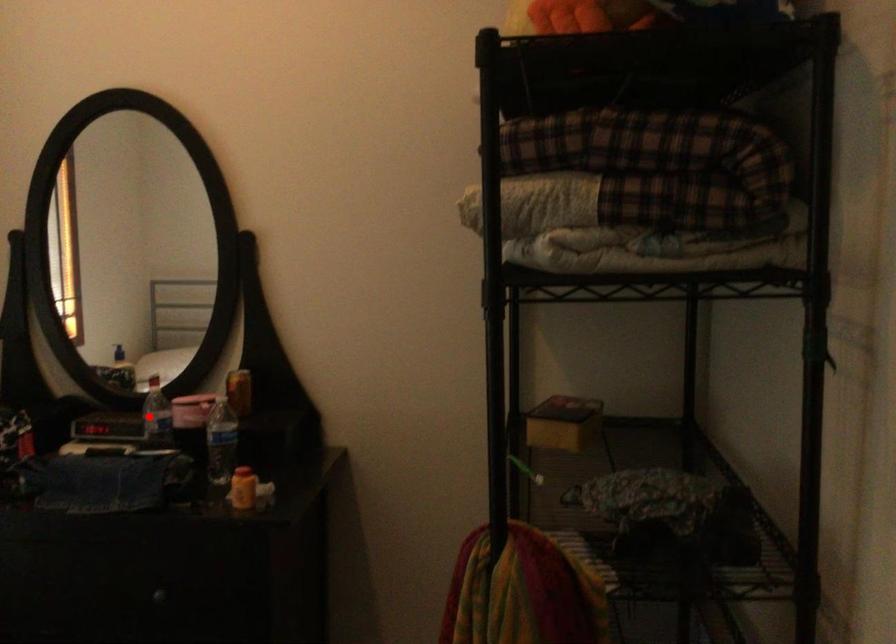
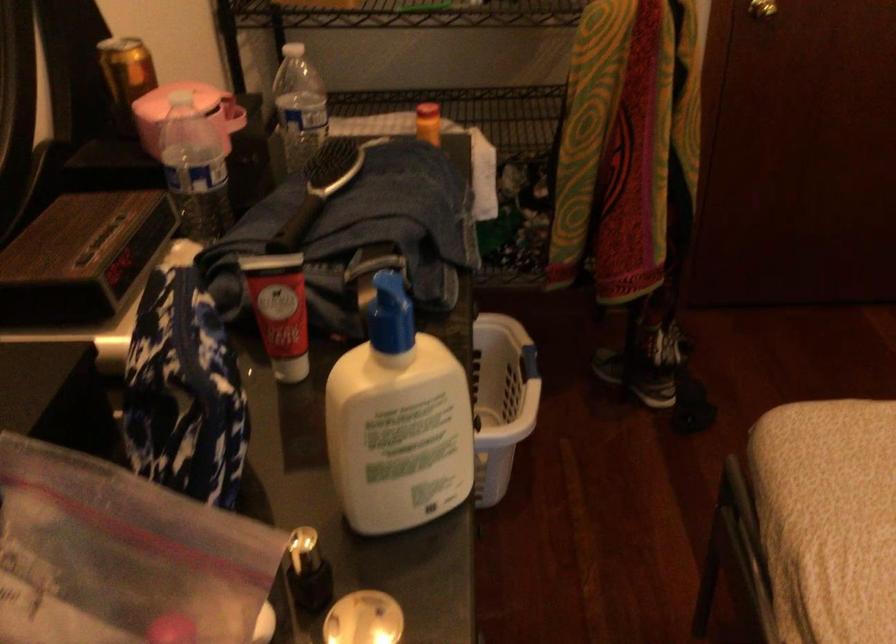
The point at the highlighted location is marked in the first image. Where is the corresponding point in the second image?

(194, 169)